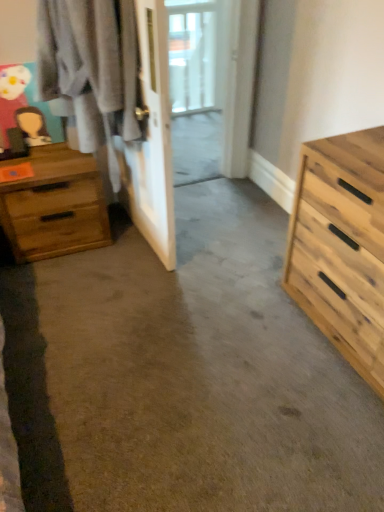
Question: In terms of height, does natural wood chest of drawers at right, marked as the first chest of drawers in a front-to-back arrangement, look taller or shorter compared to wooden chest of drawers at left, the 2th chest of drawers positioned from the right?

Choices:
 (A) short
 (B) tall

Answer: (B)

Question: In terms of size, does natural wood chest of drawers at right, the 2th chest of drawers in the back-to-front sequence, appear bigger or smaller than wooden chest of drawers at left, which ranks as the 1th chest of drawers in back-to-front order?

Choices:
 (A) big
 (B) small

Answer: (A)

Question: Which object is the closest to the wooden chest of drawers at left, the 2th chest of drawers positioned from the right?

Choices:
 (A) natural wood chest of drawers at right, placed as the second chest of drawers when sorted from left to right
 (B) wooden dresser at left
 (C) clear glass window at center

Answer: (B)

Question: Which object is the closest to the natural wood chest of drawers at right, marked as the first chest of drawers in a front-to-back arrangement?

Choices:
 (A) wooden chest of drawers at left, marked as the 1th chest of drawers in a left-to-right arrangement
 (B) wooden dresser at left
 (C) clear glass window at center

Answer: (B)